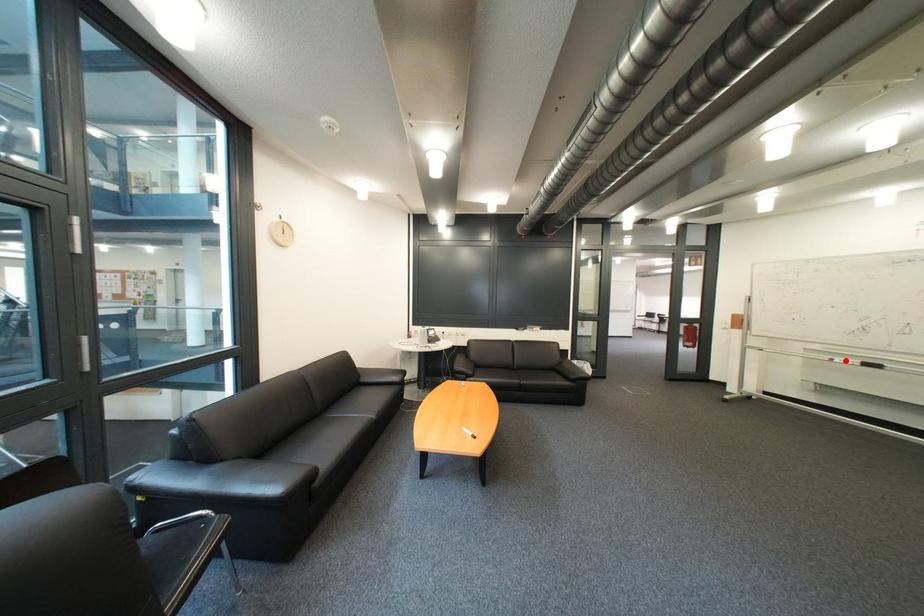
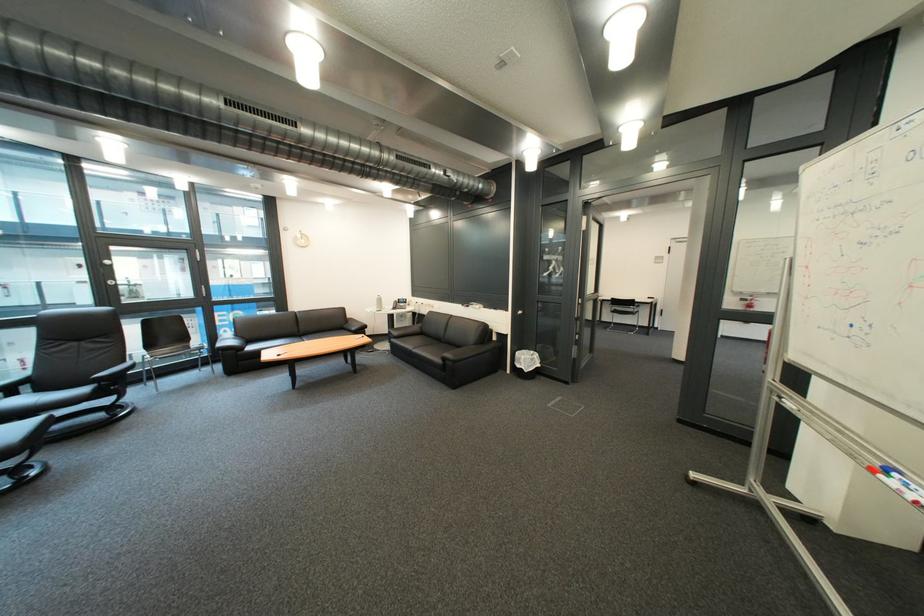
Where in the second image is the point corresponding to the highlighted location from the first image?

(901, 472)